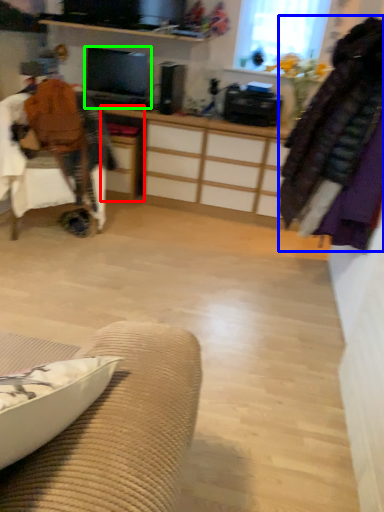
Question: Based on their relative distances, which object is farther from desk (highlighted by a red box)? Choose from clothing (highlighted by a blue box) and television (highlighted by a green box).

Choices:
 (A) clothing
 (B) television

Answer: (A)